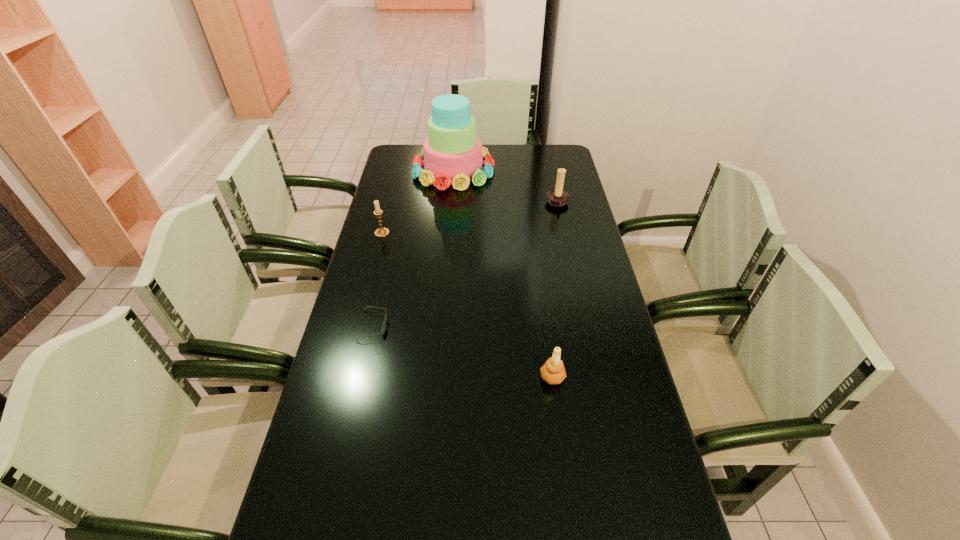
Where is `the farthest object`? The image size is (960, 540). the farthest object is located at coordinates (452, 153).

The height and width of the screenshot is (540, 960). I want to click on the tallest object, so click(x=452, y=153).

This screenshot has height=540, width=960. Identify the location of the rightmost object. (557, 197).

Where is `the rightmost candle_holder`? The height and width of the screenshot is (540, 960). the rightmost candle_holder is located at coordinates (557, 197).

At what (x,y) coordinates should I click in order to perform the action: click on the second nearest candle_holder. Please return your answer as a coordinate pair (x, y). Looking at the image, I should click on (381, 232).

Find the location of a particular element. the third farthest object is located at coordinates (381, 232).

I want to click on the second candle_holder from left to right, so click(x=553, y=371).

In order to click on the second object from right to left in this screenshot , I will do `click(553, 371)`.

Where is `the shortest object`? Image resolution: width=960 pixels, height=540 pixels. the shortest object is located at coordinates (383, 327).

Locate an element on the screen. Image resolution: width=960 pixels, height=540 pixels. the fourth farthest object is located at coordinates (383, 327).